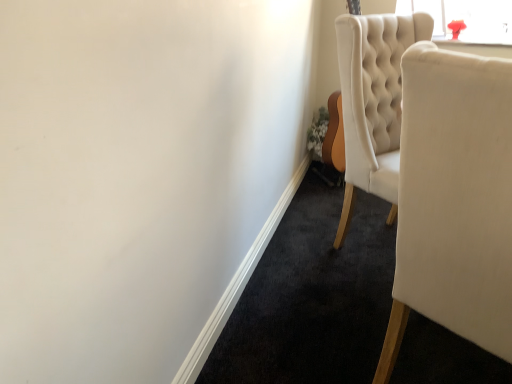
This screenshot has height=384, width=512. What are the coordinates of `matte white chair at center` in the screenshot? It's located at (454, 200).

Image resolution: width=512 pixels, height=384 pixels. Describe the element at coordinates (454, 200) in the screenshot. I see `matte white chair at center` at that location.

Measure the distance between point (x=433, y=200) and camera.

A distance of 35.91 inches exists between point (x=433, y=200) and camera.

Locate an element on the screen. This screenshot has width=512, height=384. matte white chair at center is located at coordinates (454, 200).